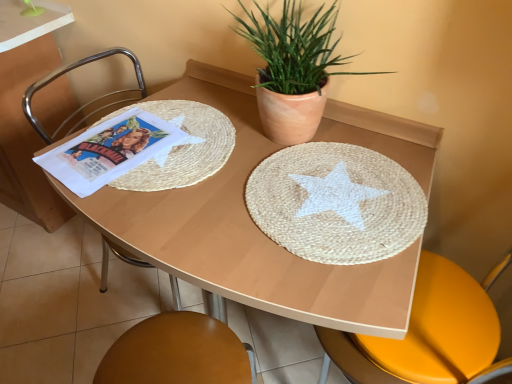
The height and width of the screenshot is (384, 512). Identify the location of vacant space to the right of white paper comic book at left. (232, 158).